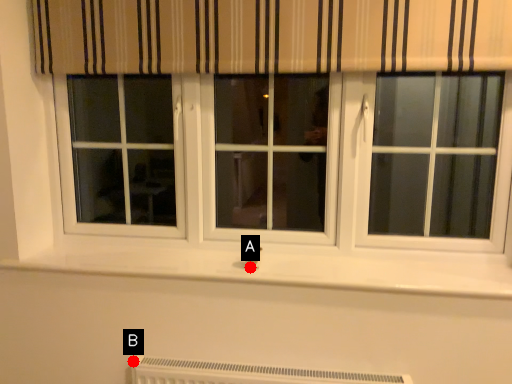
Question: Two points are circled on the image, labeled by A and B beside each circle. Which point is further to the camera?

Choices:
 (A) A is further
 (B) B is further

Answer: (B)